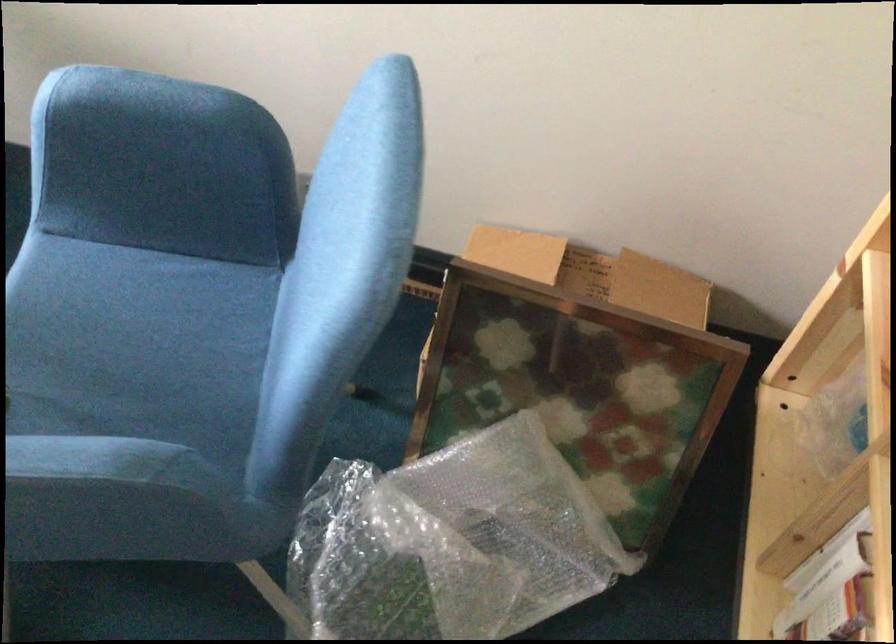
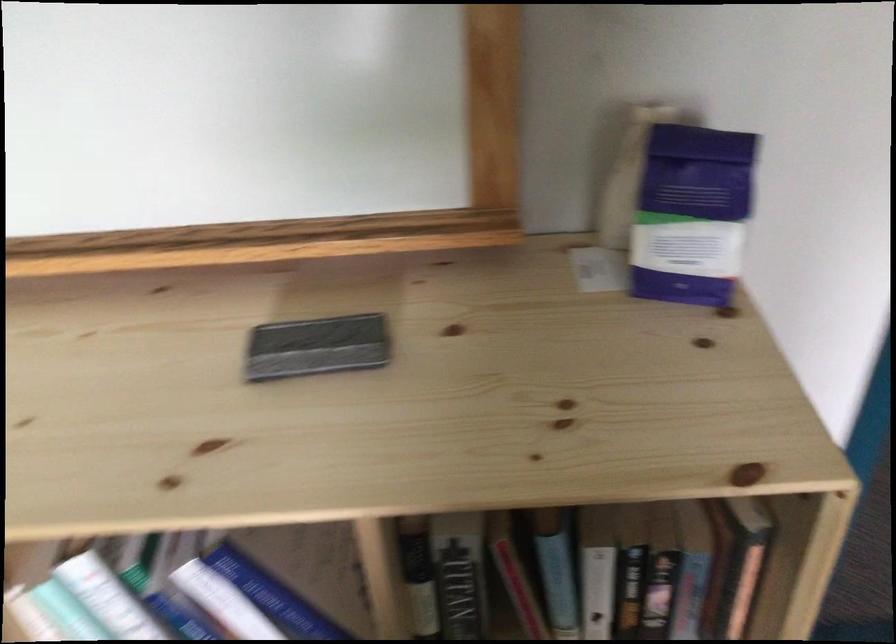
From the picture: The first image is from the beginning of the video and the second image is from the end. How did the camera likely rotate when shooting the video?

The rotation direction of the camera is right-down.